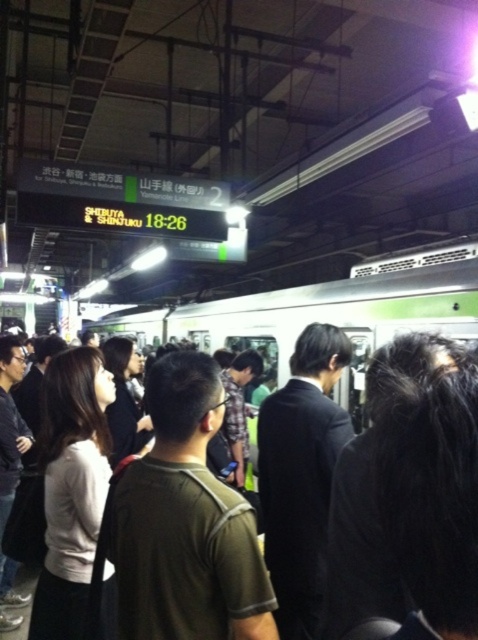
Which is behind, point (162, 541) or point (335, 605)?

The point (162, 541) is more distant.

Is dark green t-shirt at center shorter than black hair at center?

Incorrect, dark green t-shirt at center's height does not fall short of black hair at center's.

Consider the image. Measure the distance between point (x=122, y=595) and camera.

Point (x=122, y=595) is 4.96 feet away from camera.

At what (x,y) coordinates should I click in order to perform the action: click on dark green t-shirt at center. Please return your answer as a coordinate pair (x, y). The width and height of the screenshot is (478, 640). Looking at the image, I should click on (185, 522).

Does dark green t-shirt at center appear over dark suit at center?

Indeed, dark green t-shirt at center is positioned over dark suit at center.

This screenshot has height=640, width=478. In order to click on dark green t-shirt at center in this screenshot , I will do `click(185, 522)`.

Based on the photo, is dark green t-shirt at center below green metallic train at center?

Yes.

The image size is (478, 640). Find the location of `dark green t-shirt at center`. dark green t-shirt at center is located at coordinates tap(185, 522).